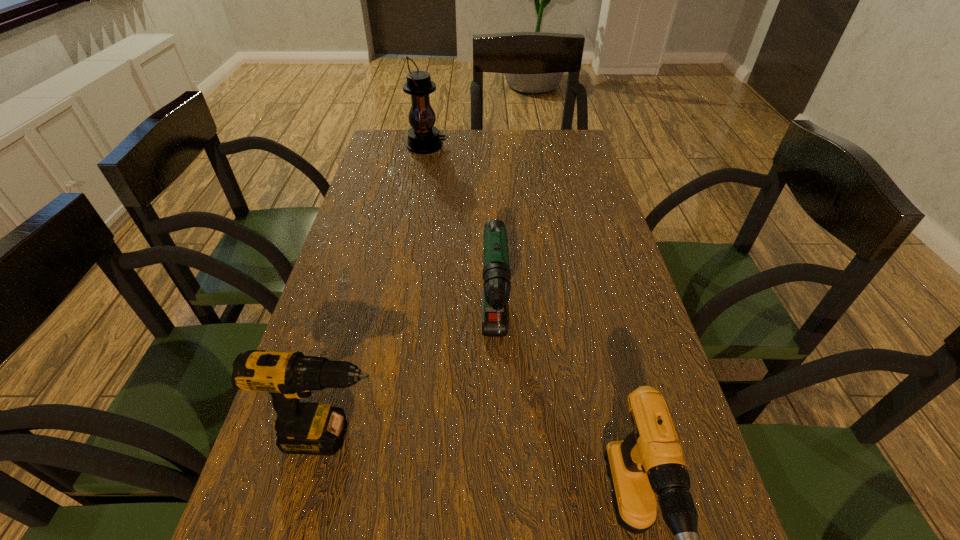
Where is `the tallest object`? The image size is (960, 540). the tallest object is located at coordinates (423, 138).

Find the location of `the farthest object`. the farthest object is located at coordinates point(423,138).

Identify the location of the third nearest object. (496, 273).

Where is `the second object from right to left`? the second object from right to left is located at coordinates (496, 273).

The width and height of the screenshot is (960, 540). I want to click on the leftmost drill, so click(x=307, y=428).

Identify a few spots in free region located above the farthest object, indicating its light source. Please provide its 2D coordinates. Your answer should be formatted as a tuple, i.e. [(x, y)], where the tuple contains the x and y coordinates of a point satisfying the conditions above.

[(514, 146)]

I want to click on free space located on the handle side of the second farthest object, so click(x=498, y=455).

Where is `free point located at the tip of the leftmost drill`? free point located at the tip of the leftmost drill is located at coordinates (595, 436).

Find the location of a particular element. object at the far edge is located at coordinates (423, 138).

Image resolution: width=960 pixels, height=540 pixels. What are the coordinates of `lantern at the left edge` in the screenshot? It's located at (423, 138).